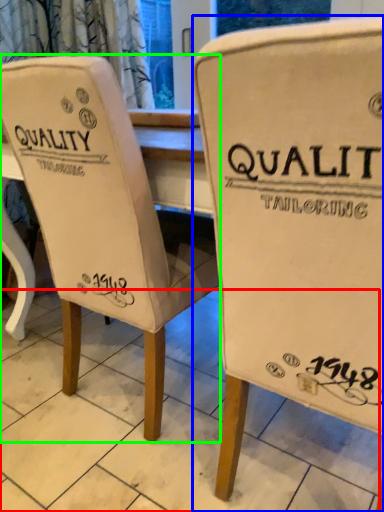
Question: Which is farther away from tile (highlighted by a red box)? chair (highlighted by a blue box) or chair (highlighted by a green box)?

Choices:
 (A) chair
 (B) chair

Answer: (A)